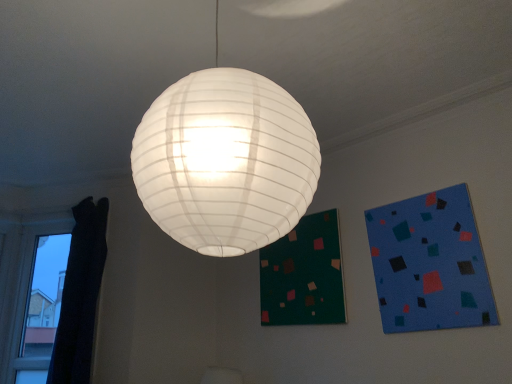
Question: From a real-world perspective, is black curtain at left positioned above or below blue matte square at upper right?

Choices:
 (A) above
 (B) below

Answer: (B)

Question: Is point (7, 240) positioned closer to the camera than point (458, 221)?

Choices:
 (A) closer
 (B) farther

Answer: (B)

Question: Based on their relative distances, which object is nearer to the blue matte square at upper right?

Choices:
 (A) dark green fabric bulletin board at lower center
 (B) black curtain at left
 (C) black fabric curtain at left

Answer: (A)

Question: Which object is positioned closest to the black curtain at left?

Choices:
 (A) black fabric curtain at left
 (B) dark green fabric bulletin board at lower center
 (C) blue matte square at upper right

Answer: (A)